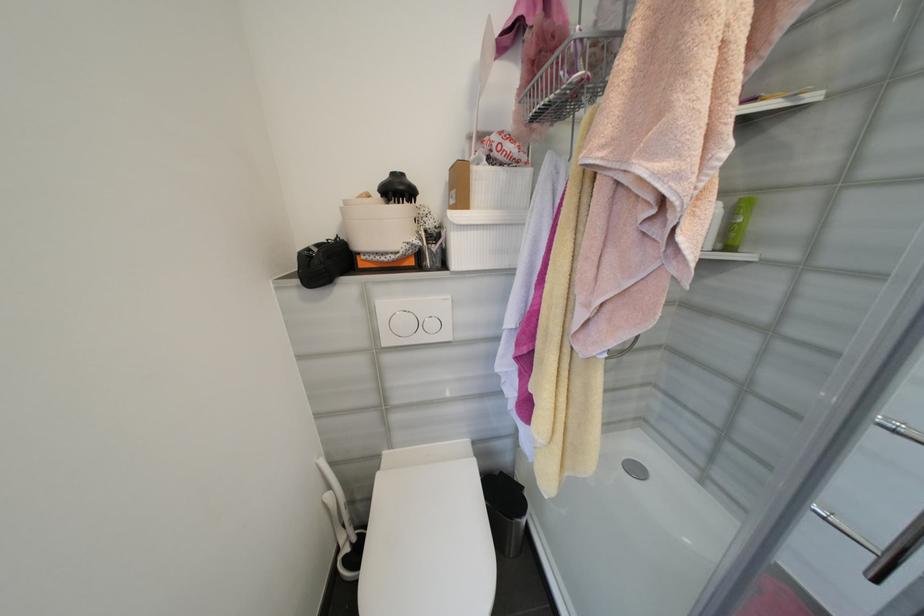
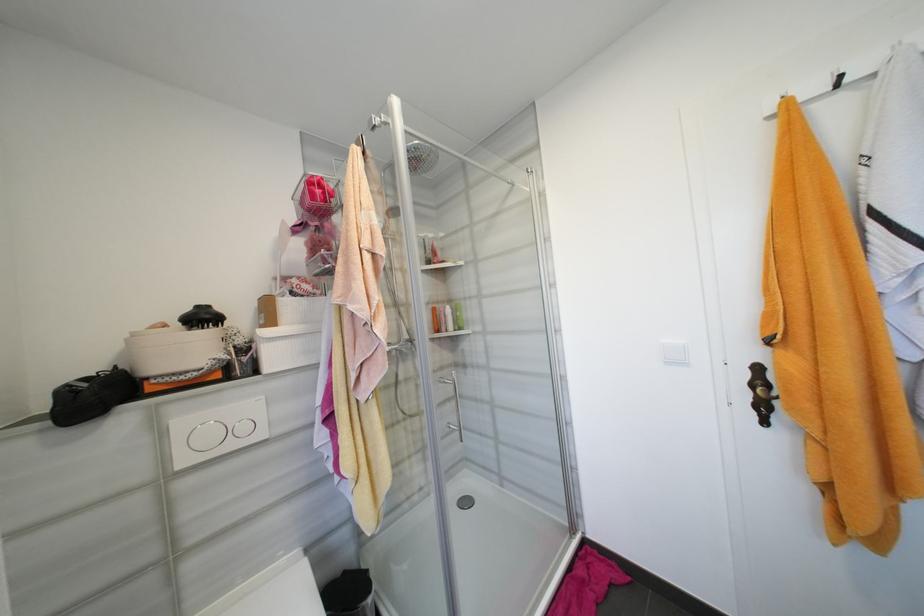
The point at (507, 476) is marked in the first image. Where is the corresponding point in the second image?

(350, 573)